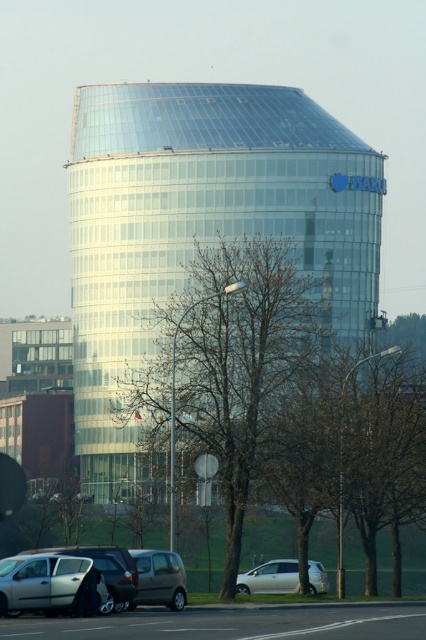
You are a delivery driver who needs to park your vehicle in the parking lot near the BARC building. You have two options for parking spots. One is next to the metallic gray van at lower left, and the other is next to the white matte van at lower center. Which parking spot would require less space for your vehicle?

The parking spot next to the metallic gray van at lower left would require less space for your vehicle since the metallic gray van at lower left occupies less space than the white matte van at lower center.

You are a delivery driver who needs to park your vehicle in the parking lot near the BARC building. You have two options for parking spots next to the metallic gray van at lower left and the white matte van at lower center. Which van should you park behind to ensure your vehicle is not visible from the main road?

You should park behind the metallic gray van at lower left because it is positioned above the white matte van at lower center, meaning it is closer to the road and would block your vehicle from view.